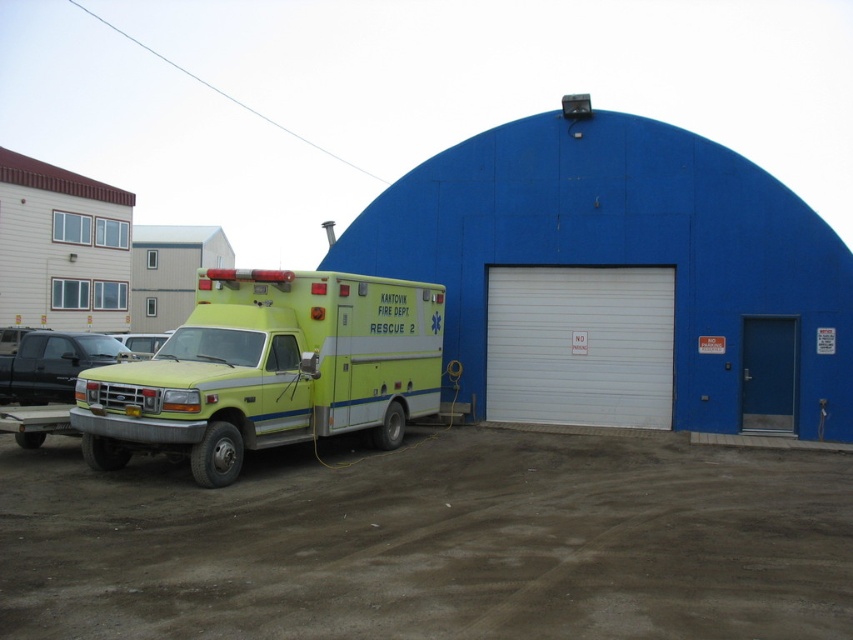
You are standing in front of the KANTOVIK FIRE DEPT RESCUE 2 emergency vehicle. There are two points marked on the garage door of the building behind the vehicle. One point is at coordinate (392, 419) and the other at (787, 412). Which point is closer to you?

The point at coordinate (392, 419) is closer to you than the point at (787, 412).

You are a delivery driver who needs to park your vehicle near the KANTOVIK FIRE DEPT RESCUE 2. The scene shows a white smooth garage door at center and a blue matte door at right. Which door should you avoid parking in front of to comply with the NO PARKING sign?

The white smooth garage door at center is to the left of blue matte door at right. Since the NO PARKING sign is on the garage door, you should avoid parking in front of the white smooth garage door at center.